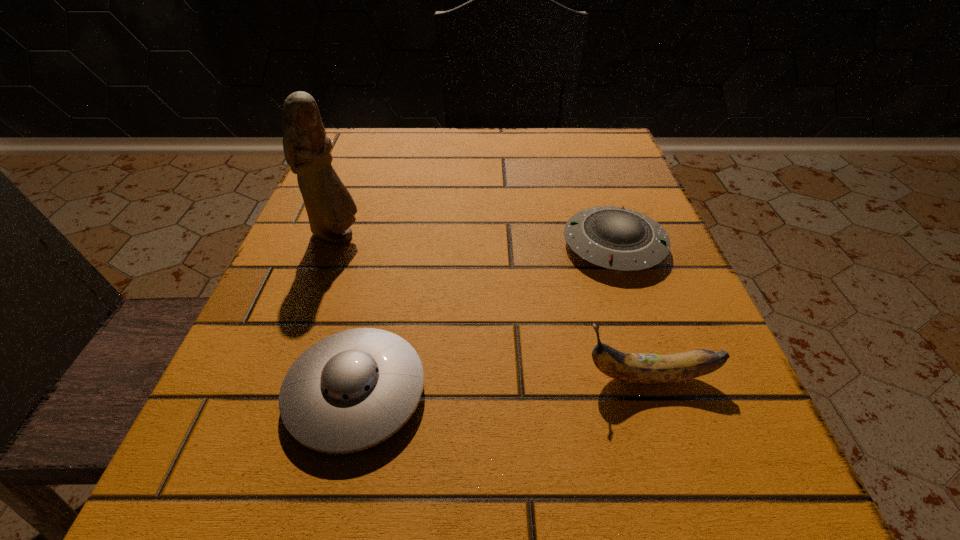
You are a GUI agent. You are given a task and a screenshot of the screen. Output one action in this format:
    pyautogui.click(x=<x>, y=<y>)
    Task: Click on the free space between the tallest object and the second tallest object
    
    Given the screenshot: What is the action you would take?
    pyautogui.click(x=492, y=307)

Locate an element on the screen. Image resolution: width=960 pixels, height=540 pixels. vacant region between the tallest object and the shortest object is located at coordinates (475, 241).

Select which object appears as the closest to the third tallest object. Please provide its 2D coordinates. Your answer should be formatted as a tuple, i.e. [(x, y)], where the tuple contains the x and y coordinates of a point satisfying the conditions above.

[(330, 207)]

I want to click on object that ranks as the closest to the nearer saucer, so click(330, 207).

Locate an element on the screen. This screenshot has width=960, height=540. vacant space that satisfies the following two spatial constraints: 1. on the front-facing side of the nearer saucer; 2. on the right side of the figurine is located at coordinates (279, 392).

Where is `free space that satisfies the following two spatial constraints: 1. on the front-facing side of the figurine; 2. on the left side of the shortest object`? The width and height of the screenshot is (960, 540). free space that satisfies the following two spatial constraints: 1. on the front-facing side of the figurine; 2. on the left side of the shortest object is located at coordinates pos(334,245).

What are the coordinates of `free space that satisfies the following two spatial constraints: 1. on the front-facing side of the tallest object; 2. on the back side of the shorter saucer` in the screenshot? It's located at (334, 245).

Where is `vacant point that satisfies the following two spatial constraints: 1. on the back side of the right saucer; 2. on the front-facing side of the figurine`? The image size is (960, 540). vacant point that satisfies the following two spatial constraints: 1. on the back side of the right saucer; 2. on the front-facing side of the figurine is located at coordinates click(x=611, y=236).

Identify the location of blank space that satisfies the following two spatial constraints: 1. on the front side of the right saucer; 2. on the peel of the banana. The image size is (960, 540). (659, 377).